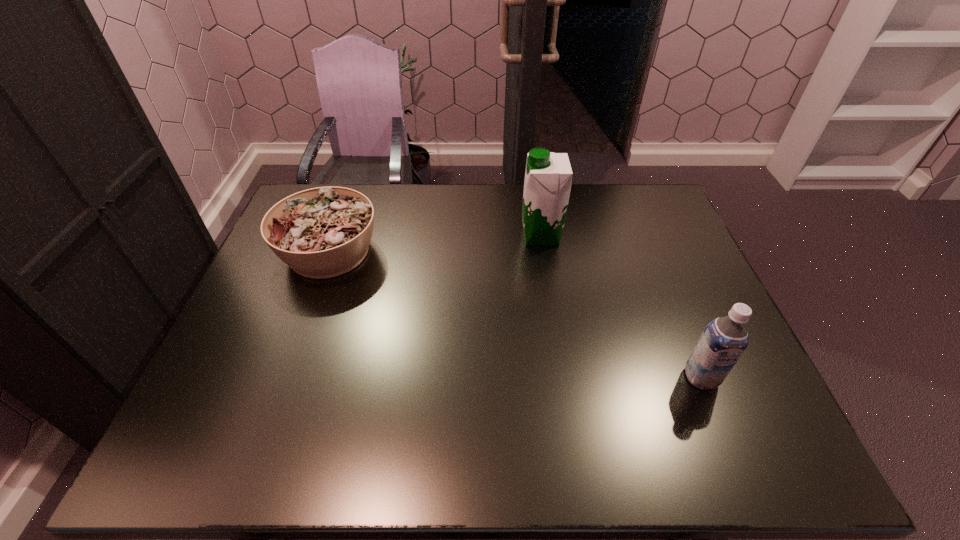
Identify the location of vacant space at the near right corner. (716, 436).

Identify the location of unoccupied area between the tallest object and the nearer soya milk. Image resolution: width=960 pixels, height=540 pixels. (621, 307).

This screenshot has height=540, width=960. In order to click on free space between the shortest object and the nearest object in this screenshot , I will do `click(515, 314)`.

At what (x,y) coordinates should I click in order to perform the action: click on free point between the leftmost object and the farther soya milk. Please return your answer as a coordinate pair (x, y). The image size is (960, 540). Looking at the image, I should click on (435, 244).

Where is `vacant area between the tallest object and the nearest object`? Image resolution: width=960 pixels, height=540 pixels. vacant area between the tallest object and the nearest object is located at coordinates (621, 307).

Find the location of a particular element. free point between the right soya milk and the farther soya milk is located at coordinates (621, 307).

Locate an element on the screen. empty space that is in between the shortest object and the taller soya milk is located at coordinates (435, 244).

You are a GUI agent. You are given a task and a screenshot of the screen. Output one action in this format:
    pyautogui.click(x=<x>, y=<y>)
    Task: Click on the free space between the left soya milk and the leftmost object
    This screenshot has width=960, height=540.
    Given the screenshot: What is the action you would take?
    pyautogui.click(x=435, y=244)

Find the location of a particular element. This screenshot has width=960, height=540. empty space that is in between the taller soya milk and the shortest object is located at coordinates (435, 244).

Locate an element on the screen. empty location between the farther soya milk and the salad is located at coordinates (435, 244).